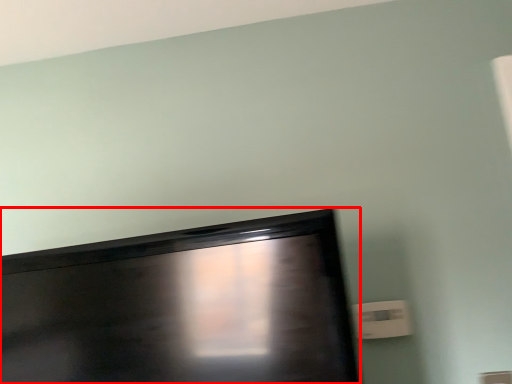
Question: From the image's perspective, considering the relative positions of television (annotated by the red box) and electric outlet in the image provided, where is television (annotated by the red box) located with respect to the staircase?

Choices:
 (A) above
 (B) below

Answer: (A)